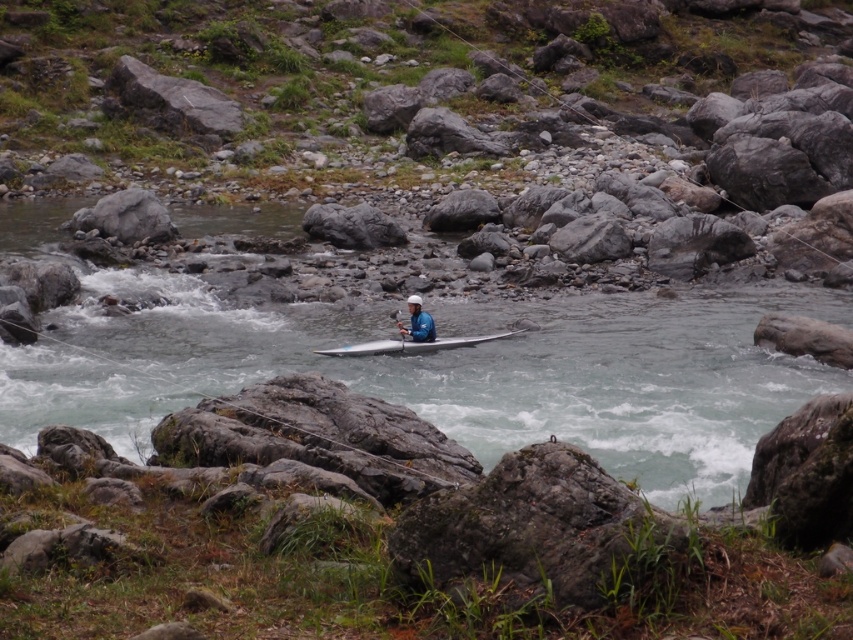
You are a drone operator trying to capture the kayaker in the center. The drone is currently hovering at point A, which is at coordinates 0.4, 0.5. To get the best shot, you need to move the drone directly above the white plastic kayak at center. What direction should you move the drone from its current position?

The white plastic kayak at center is located at point [413,344]. The drone is at [426,256]. To move directly above the kayak, you should move the drone to the right and slightly downward since the kayak is to the right and slightly below the drone.

You are a kayaker in the river scene. You see two points marked on the river. One is at point (415, 300) and the other is at point (398, 349). Which point is closer to your current position if you are facing upstream?

Point (415, 300) is in front of point (398, 349), so if you are facing upstream, the point (415, 300) is closer to your current position.

You are a photographer trying to capture the kayaker in the river scene. You notice the blue fabric helmet at center and the white plastic paddle at center. Which object should you focus on if you want to photograph the larger object?

The blue fabric helmet at center has a larger size compared to the white plastic paddle at center, so you should focus on the blue fabric helmet at center for the larger object.